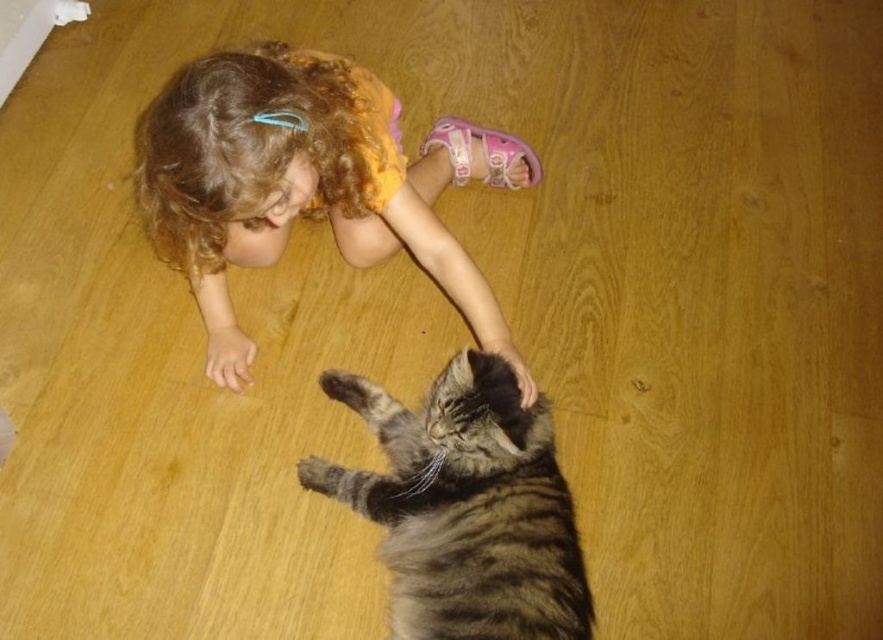
You are a toy placed on the wooden floor. You can see the point at (275, 179) and the point at (507, 476). Which point is closer to you?

Point at (275, 179) is closer to you because it is in front of point at (507, 476).

You are a photographer trying to capture a photo of the curly blonde hair at upper left and the striped fur cat at lower center. Since you want both subjects to be in focus, you need to know which one is taller. Can you tell me which one is taller?

The curly blonde hair at upper left is much taller than the striped fur cat at lower center, so you should focus on the curly blonde hair at upper left to ensure both are in focus.